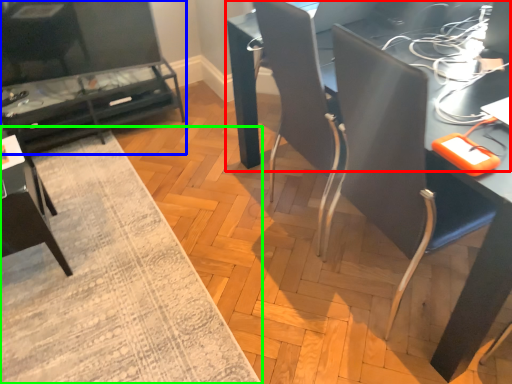
Question: Which object is positioned closest to table (highlighted by a red box)? Select from table (highlighted by a blue box) and mat (highlighted by a green box).

Choices:
 (A) table
 (B) mat

Answer: (B)